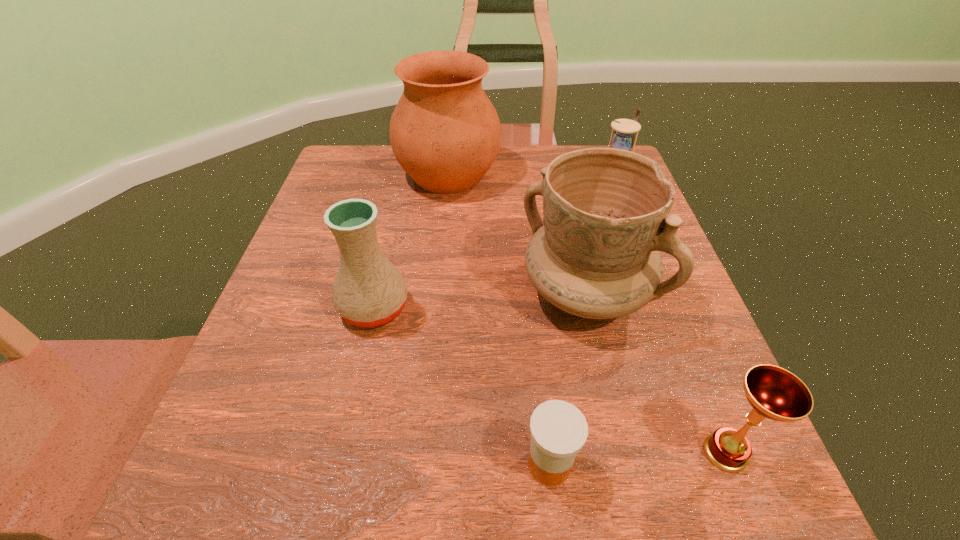
You are a GUI agent. You are given a task and a screenshot of the screen. Output one action in this format:
    pyautogui.click(x=<x>, y=<y>)
    Task: Click on the farthest pottery
    
    Given the screenshot: What is the action you would take?
    pyautogui.click(x=445, y=133)

At what (x,y) coordinates should I click in order to perform the action: click on the rightmost pottery. Please return your answer as a coordinate pair (x, y). Image resolution: width=960 pixels, height=540 pixels. Looking at the image, I should click on (605, 210).

Locate an element on the screen. The height and width of the screenshot is (540, 960). the third tallest object is located at coordinates (369, 291).

Identify the location of hourglass. (623, 138).

Find the location of `chalice`. chalice is located at coordinates (775, 393).

Where is `medicine`? The height and width of the screenshot is (540, 960). medicine is located at coordinates (558, 429).

What are the coordinates of `vacant space located on the front of the farthest pottery` in the screenshot? It's located at (436, 306).

Locate an element on the screen. The height and width of the screenshot is (540, 960). vacant space situated 0.350m on the back of the rightmost pottery is located at coordinates (556, 164).

Locate an element on the screen. This screenshot has height=540, width=960. vacant space located 0.160m on the front of the shortest pottery is located at coordinates (348, 421).

The image size is (960, 540). Identify the location of vacant area situated 0.070m on the left of the hourglass. (569, 184).